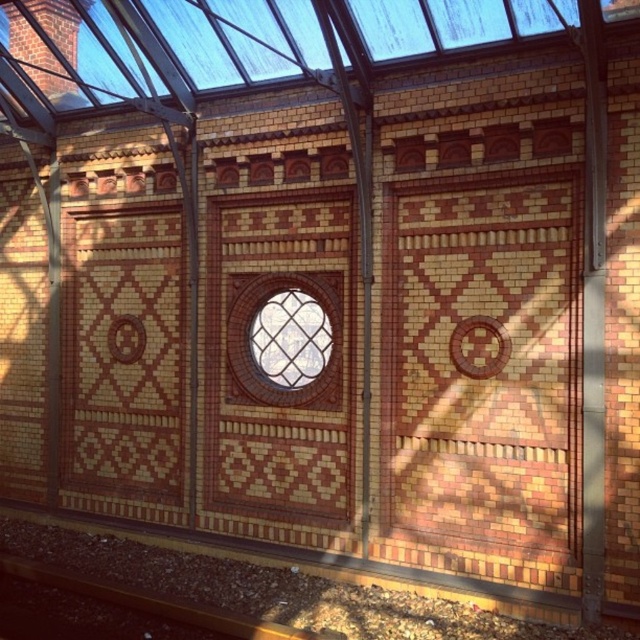
You are standing inside the conservatory and want to walk towards the clear glass window at center. Which direction should you move to avoid the brown gravel at bottom?

To avoid the brown gravel at bottom, you should move towards the clear glass window at center since the gravel is located behind the window, meaning it is further away from your current position.

You are designing a layout for a new exhibit in the conservatory. You need to place a 3D sculpture that requires a wide base. Given the clear glass window at center and the brown gravel at bottom, which object provides a larger area for the sculpture base?

The brown gravel at bottom has a greater width than the clear glass window at center, so it would provide a larger area for the sculpture base.

You are standing in the conservatory and want to move from the point at coordinates point (227,323) to the point at coordinates point (182,621). Can you walk directly between them without any obstacles?

Point (227,323) is behind point (182,621), so there is an obstacle blocking the path between them. You cannot walk directly between them without going around.